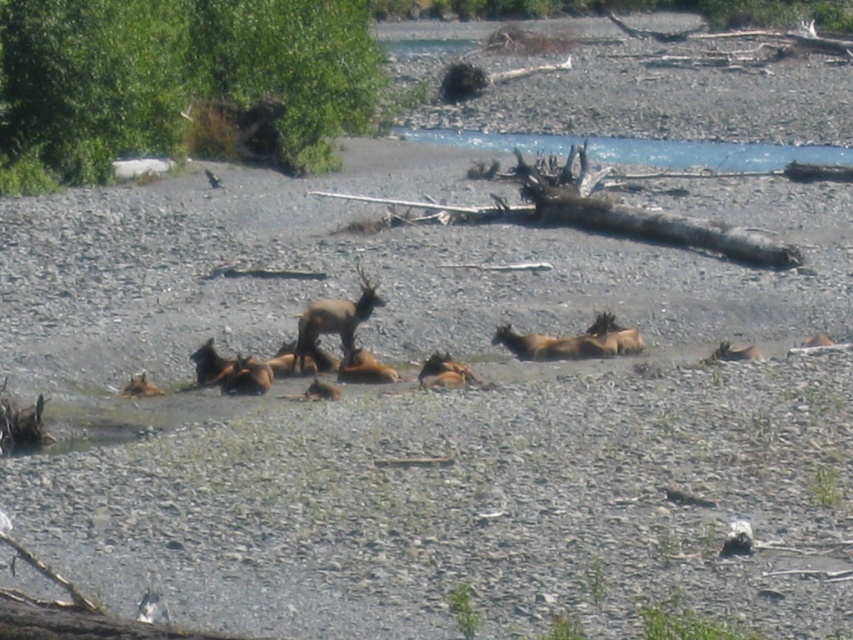
Who is more forward, (376, 300) or (726, 340)?

Point (376, 300) is more forward.

Image resolution: width=853 pixels, height=640 pixels. What are the coordinates of `brown furry deer at center` in the screenshot? It's located at (334, 320).

Does point (54, 54) come behind point (358, 314)?

That is True.

This screenshot has width=853, height=640. What do you see at coordinates (184, 84) in the screenshot? I see `green leafy bush at upper left` at bounding box center [184, 84].

Between point (15, 65) and point (369, 307), which one is positioned behind?

Positioned behind is point (15, 65).

You are a GUI agent. You are given a task and a screenshot of the screen. Output one action in this format:
    pyautogui.click(x=<x>, y=<y>)
    Task: Click on the green leafy bush at upper left
    This screenshot has width=853, height=640.
    Given the screenshot: What is the action you would take?
    pyautogui.click(x=184, y=84)

Does green leafy bush at upper left have a greater width compared to clear blue water at upper center?

Correct, the width of green leafy bush at upper left exceeds that of clear blue water at upper center.

The width and height of the screenshot is (853, 640). Identify the location of green leafy bush at upper left. (184, 84).

Find the location of a particular element. Image resolution: width=853 pixels, height=640 pixels. green leafy bush at upper left is located at coordinates (184, 84).